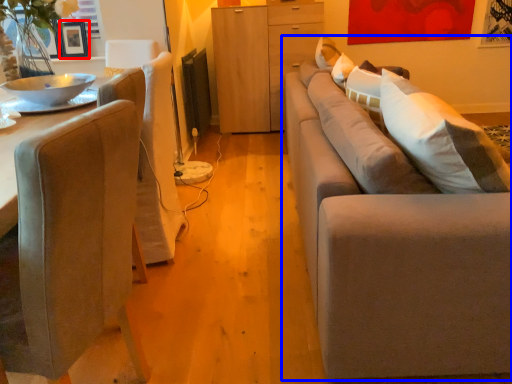
Question: Which of the following is the closest to the observer, picture frame (highlighted by a red box) or studio couch (highlighted by a blue box)?

Choices:
 (A) picture frame
 (B) studio couch

Answer: (B)